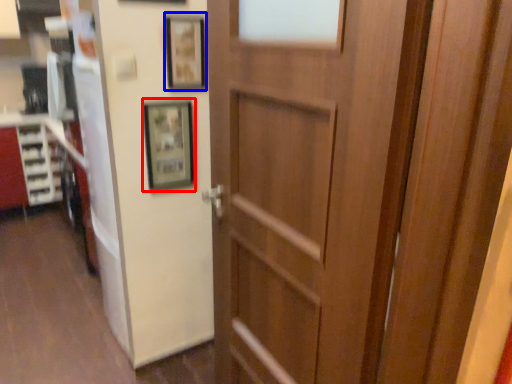
Question: Among these objects, which one is nearest to the camera, picture frame (highlighted by a red box) or picture frame (highlighted by a blue box)?

Choices:
 (A) picture frame
 (B) picture frame

Answer: (B)